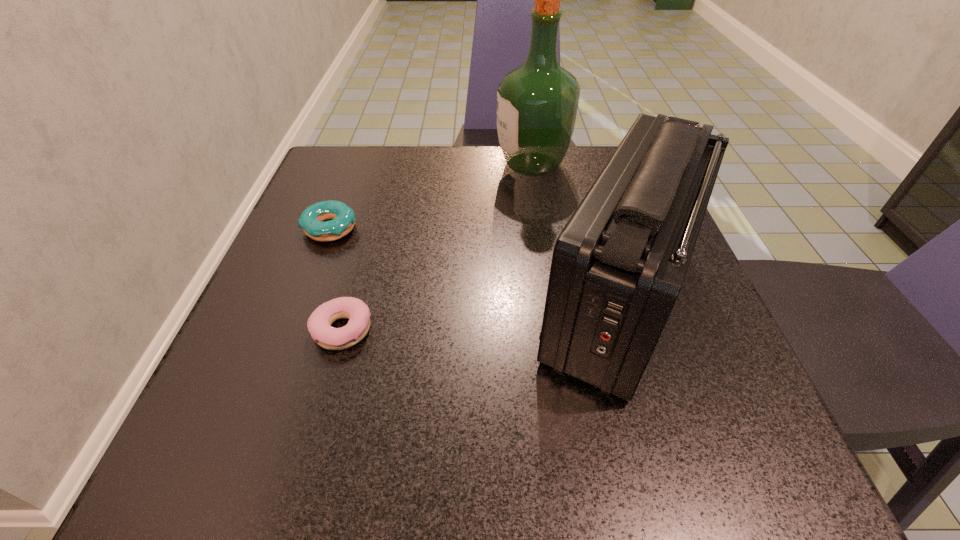
The width and height of the screenshot is (960, 540). Find the location of `the farthest object`. the farthest object is located at coordinates (537, 102).

Identify the location of the tallest object. The height and width of the screenshot is (540, 960). (537, 102).

At what (x,y) coordinates should I click in order to perform the action: click on the second tallest object. Please return your answer as a coordinate pair (x, y). This screenshot has height=540, width=960. Looking at the image, I should click on (618, 265).

This screenshot has width=960, height=540. In order to click on the nearer doughnut in this screenshot , I will do `click(319, 323)`.

This screenshot has height=540, width=960. I want to click on the farther doughnut, so click(342, 219).

Identify the location of free spot located on the front-facing side of the liquor. Image resolution: width=960 pixels, height=540 pixels. (348, 164).

You are a GUI agent. You are given a task and a screenshot of the screen. Output one action in this format:
    pyautogui.click(x=<x>, y=<y>)
    Task: Click on the vacant space located 0.170m on the front-facing side of the liquor
    The image size is (960, 540).
    Given the screenshot: What is the action you would take?
    pyautogui.click(x=423, y=164)

Locate an element on the screen. Image resolution: width=960 pixels, height=540 pixels. vacant space located on the front-facing side of the liquor is located at coordinates (427, 164).

At what (x,y) coordinates should I click in order to perform the action: click on vacant space located 0.160m on the front panel of the radio receiver. Please return your answer as a coordinate pair (x, y). Looking at the image, I should click on (433, 301).

I want to click on vacant space located on the front panel of the radio receiver, so click(367, 301).